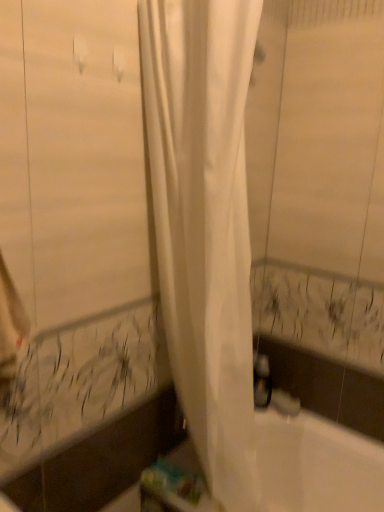
Question: Should I look upward or downward to see satin silver faucet at lower center?

Choices:
 (A) down
 (B) up

Answer: (A)